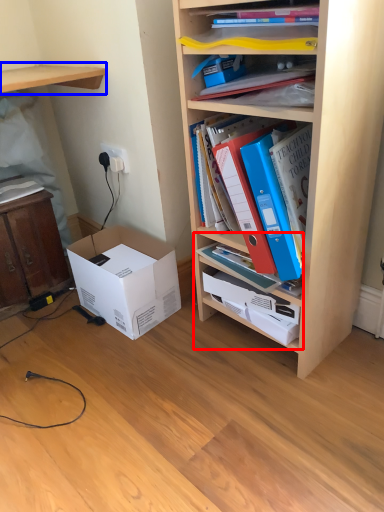
Question: Which of the following is the farthest to the observer, cabinet (highlighted by a red box) or shelf (highlighted by a blue box)?

Choices:
 (A) cabinet
 (B) shelf

Answer: (B)